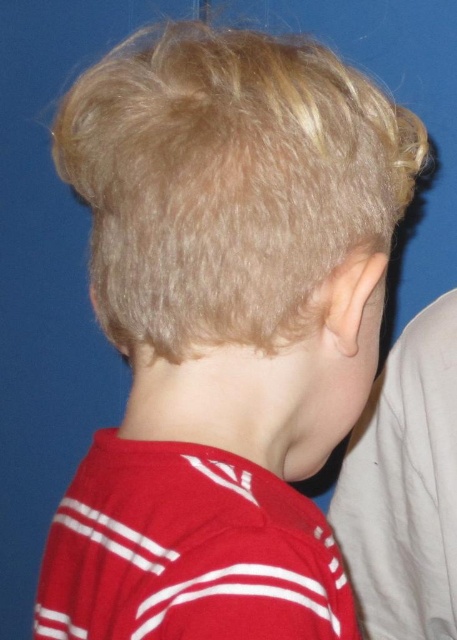
Question: Which object is closer to the camera taking this photo?

Choices:
 (A) red striped jersey at center
 (B) smooth skin ear at center

Answer: (A)

Question: Is red striped jersey at center positioned at the back of smooth skin ear at center?

Choices:
 (A) yes
 (B) no

Answer: (B)

Question: Where is red striped jersey at center located in relation to smooth skin ear at center in the image?

Choices:
 (A) left
 (B) right

Answer: (A)

Question: Which object appears farthest from the camera in this image?

Choices:
 (A) red striped jersey at center
 (B) smooth skin ear at center

Answer: (B)

Question: Which of the following is the closest to the observer?

Choices:
 (A) (129, 525)
 (B) (448, 301)

Answer: (A)

Question: Is red striped jersey at center in front of smooth skin ear at center?

Choices:
 (A) yes
 (B) no

Answer: (A)